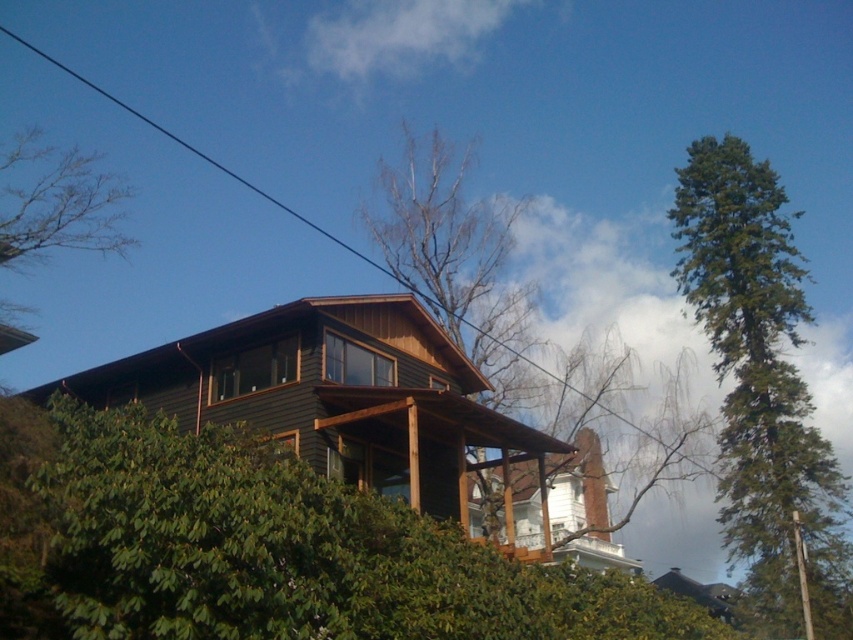
You are planning to plant a new garden in your backyard and want to know which tree takes up more space. Based on the image, which tree between the green matte tree at lower left and the bare wood tree at center would require more space?

The bare wood tree at center requires more space because it occupies more space than the green matte tree at lower left.

Based on the scene description, where is the green matte tree at lower left located in the image? Please provide its coordinates as a point in the format of a tuple.

The green matte tree at lower left is located at point coordinates of (293, 552).

You are a drone operator trying to fly a drone between two trees in the residential area. The green matte tree at lower left and the green textured tree at right are in your path. Based on their positions, which tree should you aim to fly under to avoid hitting the other tree?

You should aim to fly under the green textured tree at right because the green matte tree at lower left is located below it, meaning the lower tree is closer to the ground and the higher one is above, so flying under the upper tree would allow clearance over the lower one.